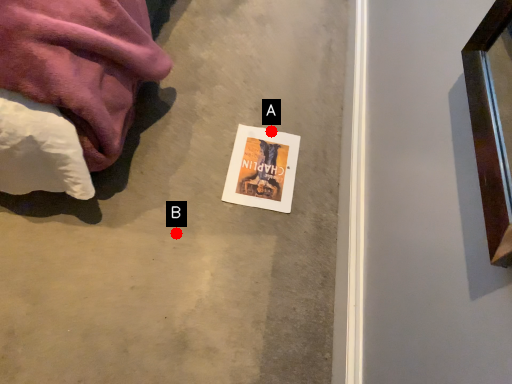
Question: Two points are circled on the image, labeled by A and B beside each circle. Which point appears closest to the camera in this image?

Choices:
 (A) A is closer
 (B) B is closer

Answer: (B)